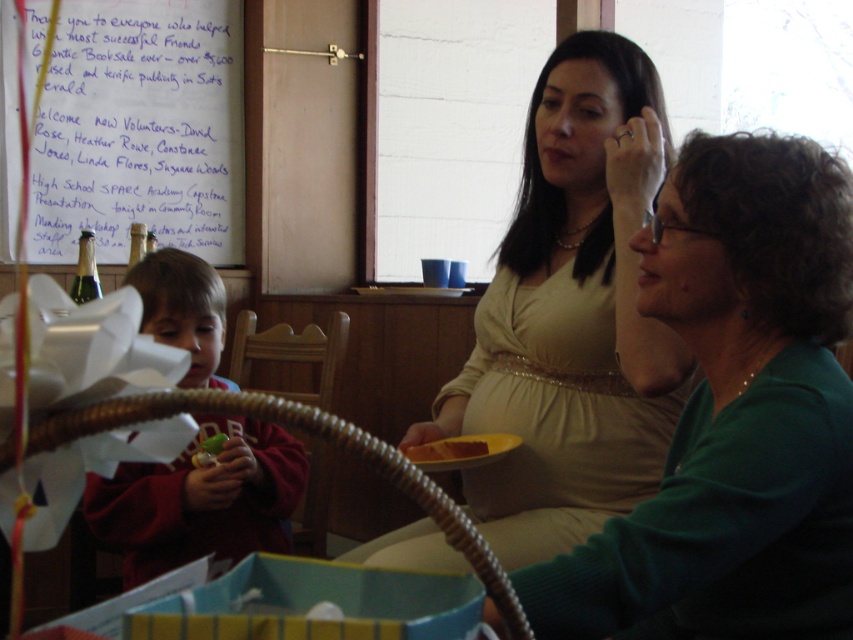
Question: Which object is farther from the camera taking this photo?

Choices:
 (A) green matte sweater at center
 (B) matte green sweater at center
 (C) yellow cake at center
 (D) whiteboard at upper left

Answer: (D)

Question: Which is nearer to the green matte sweater at center?

Choices:
 (A) whiteboard at upper left
 (B) matte green sweater at center
 (C) matte red hoodie at left
 (D) yellow cake at center

Answer: (B)

Question: Does green matte sweater at center have a lesser width compared to matte green sweater at center?

Choices:
 (A) yes
 (B) no

Answer: (A)

Question: Is matte green sweater at center above matte red hoodie at left?

Choices:
 (A) yes
 (B) no

Answer: (A)

Question: Does green matte sweater at center have a lesser width compared to whiteboard at upper left?

Choices:
 (A) no
 (B) yes

Answer: (B)

Question: Which object is closer to the camera taking this photo?

Choices:
 (A) matte red hoodie at left
 (B) matte green sweater at center
 (C) whiteboard at upper left
 (D) yellow cake at center

Answer: (B)